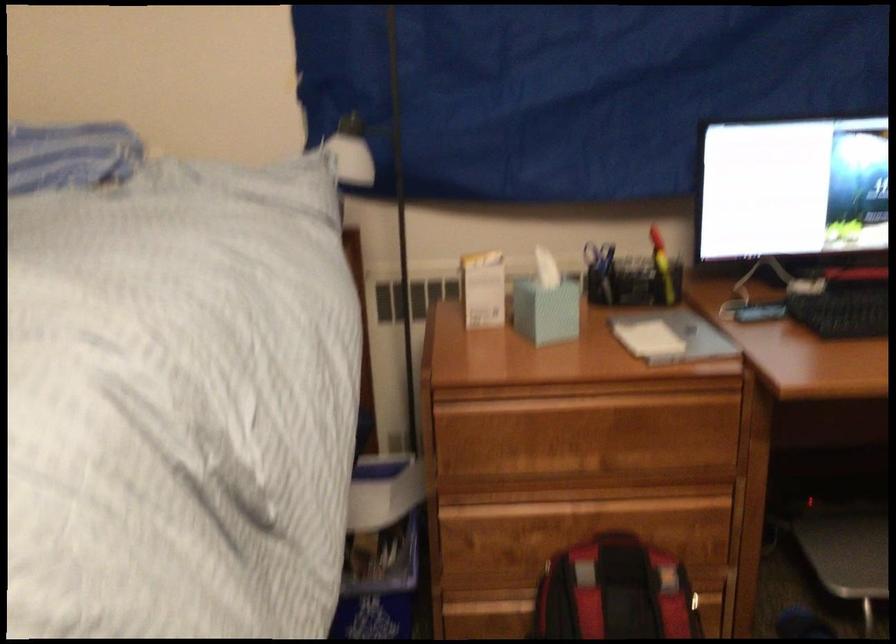
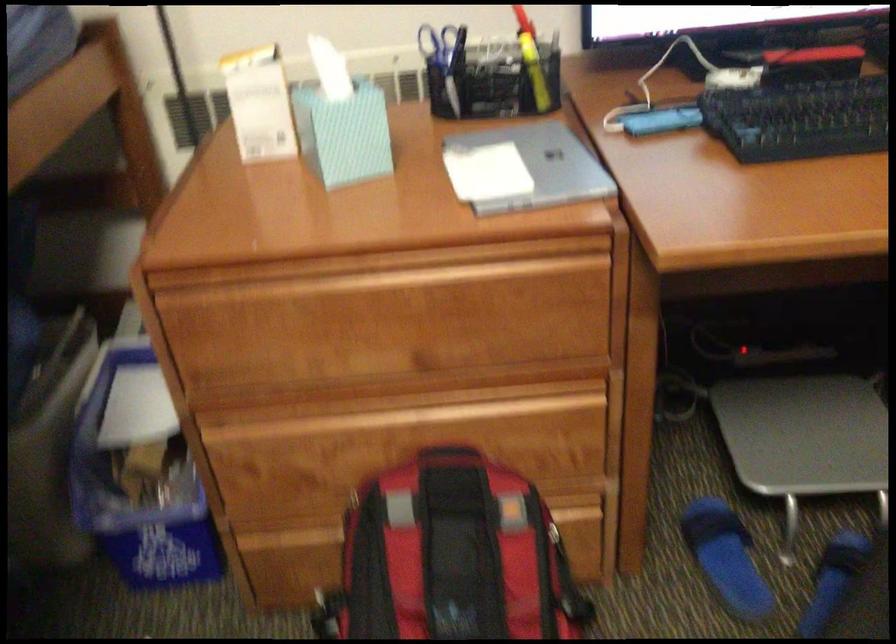
Question: The images are taken continuously from a first-person perspective. In which direction is your viewpoint rotating?

Choices:
 (A) Left
 (B) Right
 (C) Up
 (D) Down

Answer: (D)